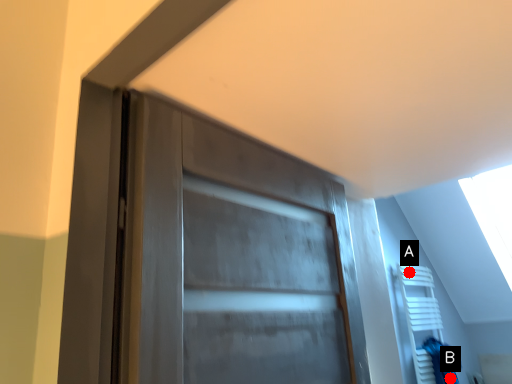
Question: Two points are circled on the image, labeled by A and B beside each circle. Which point appears farthest from the camera in this image?

Choices:
 (A) A is further
 (B) B is further

Answer: (A)